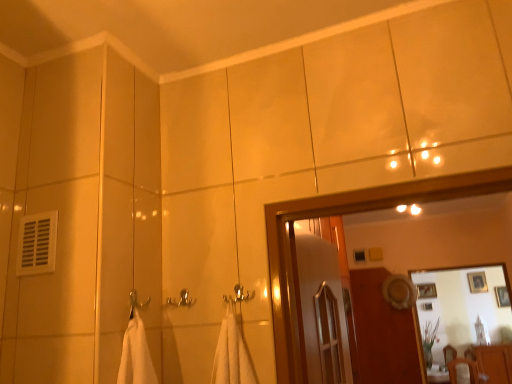
Question: In terms of height, does wooden framed picture at upper right, which is the first picture frame from right to left, look taller or shorter compared to matte brown dresser at lower right?

Choices:
 (A) tall
 (B) short

Answer: (B)

Question: From the image's perspective, is wooden framed picture at upper right, which is the first picture frame from right to left, located above or below matte brown dresser at lower right?

Choices:
 (A) below
 (B) above

Answer: (B)

Question: Estimate the real-world distances between objects in this image. Which object is closer to the matte brown dresser at lower right?

Choices:
 (A) wooden framed picture at upper right, the second picture frame from the right
 (B) wooden framed picture at upper right, which is the first picture frame from right to left
 (C) glossy wooden mirror at upper center
 (D) silver metallic towel bar at center
 (E) wooden screen door at center

Answer: (C)

Question: Based on their relative distances, which object is farther from the wooden screen door at center?

Choices:
 (A) wooden framed picture at upper right, the second picture frame from the right
 (B) wooden framed picture at upper right, which is the first picture frame from right to left
 (C) glossy wooden mirror at upper center
 (D) silver metallic towel bar at center
 (E) matte brown dresser at lower right

Answer: (D)